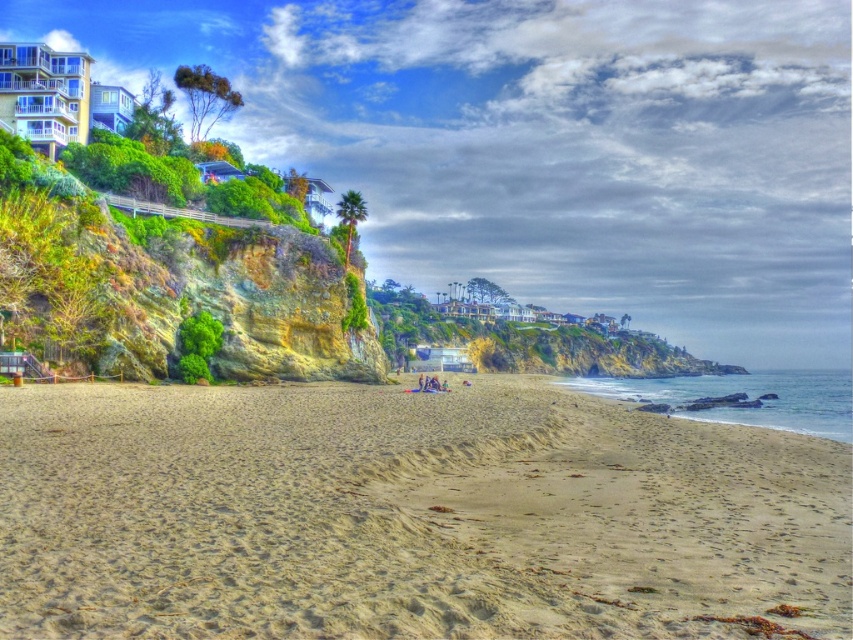
Is light beige sand at center positioned before green mossy rock at upper left?

Yes, it is.

Does light beige sand at center have a greater height compared to green mossy rock at upper left?

Incorrect, light beige sand at center's height is not larger of green mossy rock at upper left's.

Does point (53, 580) come in front of point (170, 259)?

That is True.

Locate an element on the screen. The width and height of the screenshot is (853, 640). light beige sand at center is located at coordinates (407, 515).